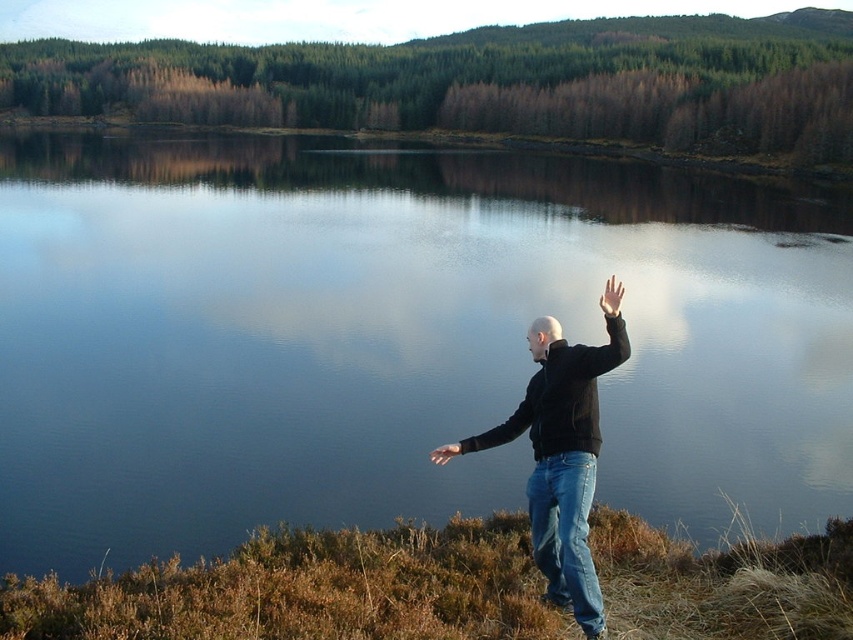
Between point (601, 296) and point (531, 412), which one is positioned in front?

Positioned in front is point (531, 412).

Does black matte arm at right appear on the left side of black matte arm at center?

Incorrect, black matte arm at right is not on the left side of black matte arm at center.

Who is more distant from viewer, [618,362] or [508,422]?

The point [508,422] is behind.

Identify the location of black matte arm at right. The height and width of the screenshot is (640, 853). pyautogui.click(x=607, y=333).

Does black matte jacket at center come in front of black matte arm at center?

That is True.

Find the location of `black matte jacket at center`. black matte jacket at center is located at coordinates (561, 460).

You are a GUI agent. You are given a task and a screenshot of the screen. Output one action in this format:
    pyautogui.click(x=<x>, y=<y>)
    Task: Click on the black matte jacket at center
    The height and width of the screenshot is (640, 853).
    Given the screenshot: What is the action you would take?
    pyautogui.click(x=561, y=460)

Can you confirm if black matte arm at right is taller than matte black hand at lower right?

Yes, black matte arm at right is taller than matte black hand at lower right.

Who is more forward, [613,339] or [457,445]?

Positioned in front is point [613,339].

Does point (579, 353) come in front of point (431, 452)?

Yes, it is in front of point (431, 452).

At what (x,y) coordinates should I click in order to perform the action: click on black matte arm at right. Please return your answer as a coordinate pair (x, y). The height and width of the screenshot is (640, 853). Looking at the image, I should click on (607, 333).